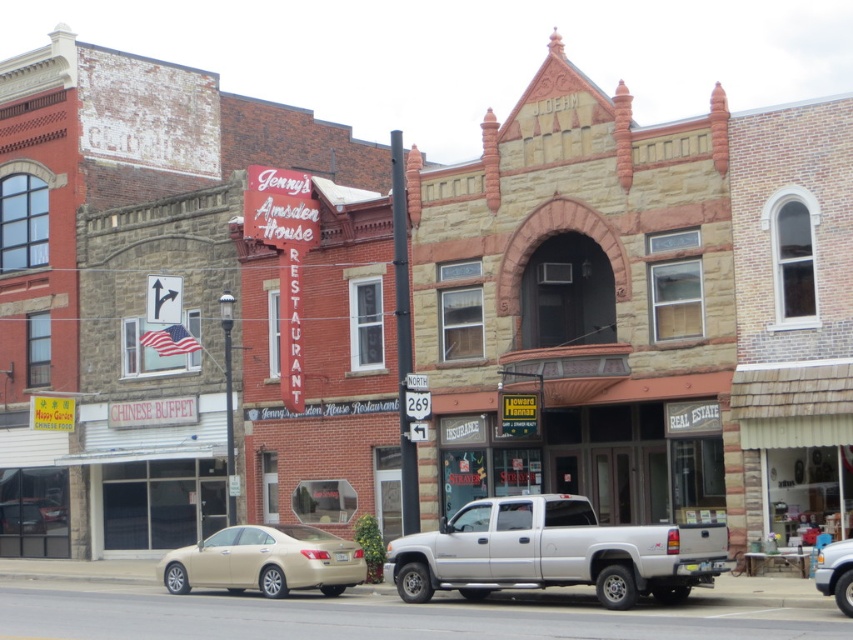
You are driving a gold metallic sedan at center and want to park it to the right of the metallic silver truck at center. Is this possible given their current positions?

The gold metallic sedan at center is positioned on the left side of metallic silver truck at center, so it is already to the left. To park it to the right of the truck, you would need to move it to the right side of the truck.

You are a delivery driver needing to park your vehicle near the J. JOHNSON building. The parking spot you found is at coordinates point 0.878, 0.312. Is the gold metallic sedan at center blocking your parking spot?

The gold metallic sedan at center is located at point (265, 561), which matches the coordinates of the parking spot you found. Therefore, the gold metallic sedan at center is blocking your parking spot.